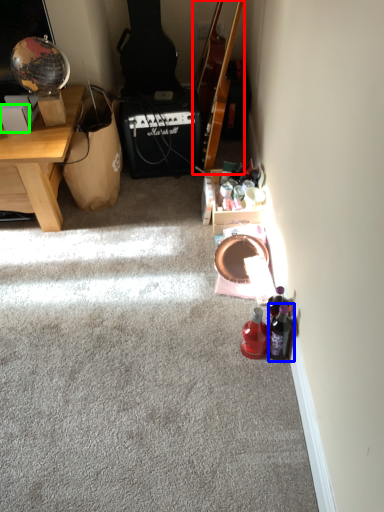
Question: Which is nearer to the guitar (highlighted by a red box)? bottle (highlighted by a blue box) or box (highlighted by a green box).

Choices:
 (A) bottle
 (B) box

Answer: (B)